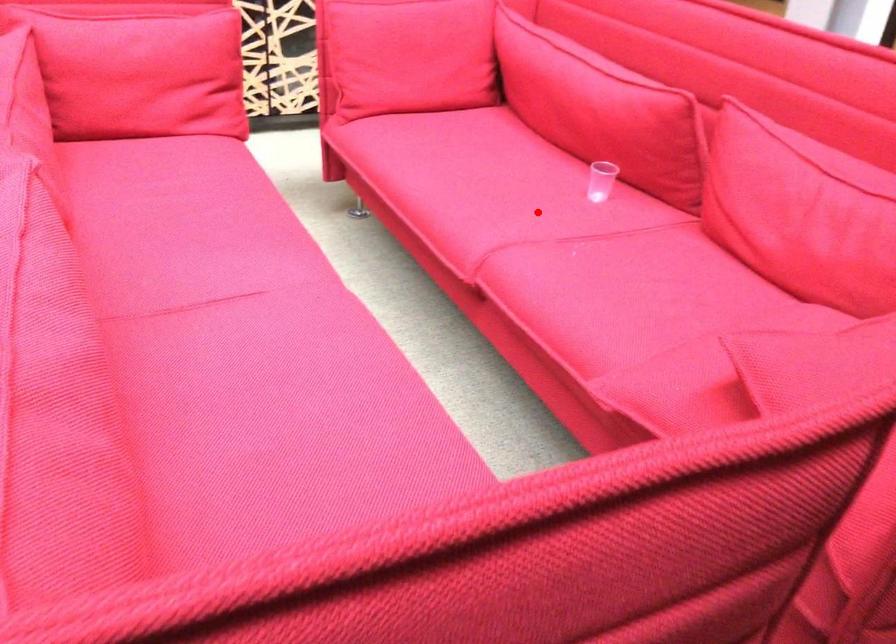
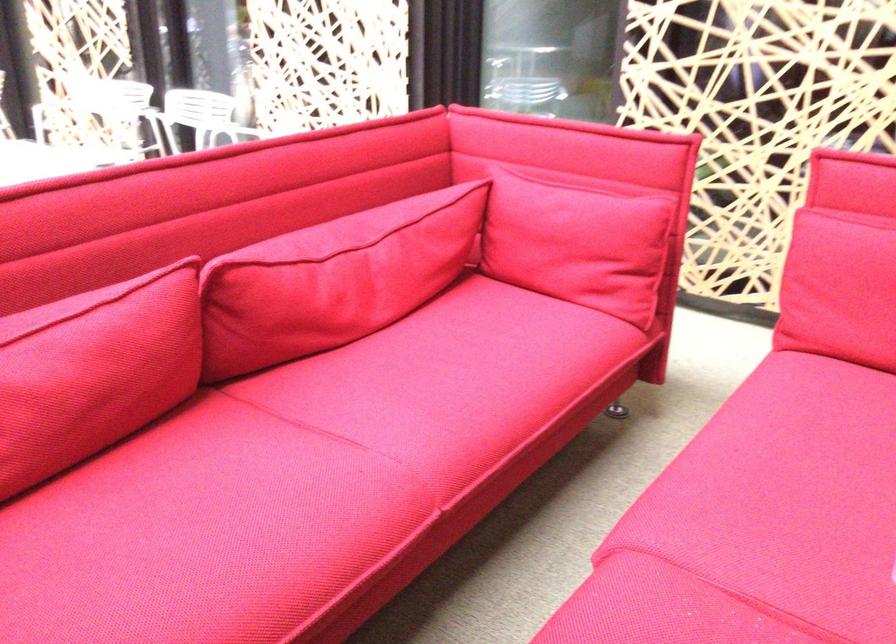
Question: I am providing you with two images of the same scene from different viewpoints. In image1, a red point is highlighted. Considering the same 3D point in image2, which of the following is correct?

Choices:
 (A) It is closer
 (B) It is farther

Answer: (A)